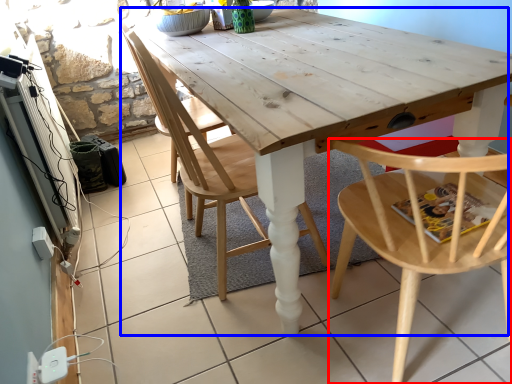
Question: Which object appears closest to the camera in this image, chair (highlighted by a red box) or table (highlighted by a blue box)?

Choices:
 (A) chair
 (B) table

Answer: (A)